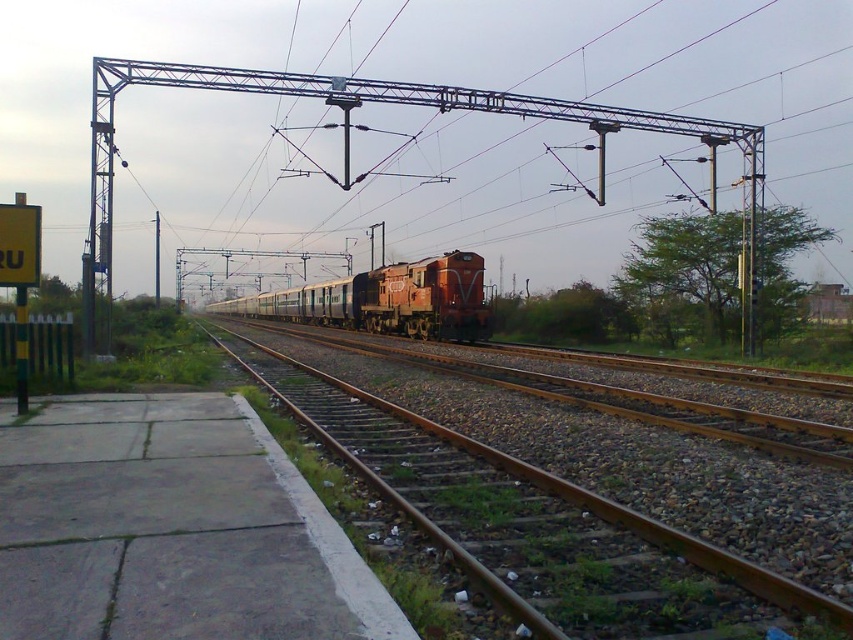
Can you confirm if matte red locomotive at center is taller than metallic pole at left?

No, matte red locomotive at center is not taller than metallic pole at left.

Between point (430, 321) and point (154, 275), which one is positioned in front?

Point (430, 321) is in front.

Who is more distant from viewer, (386, 310) or (158, 268)?

The point (158, 268) is behind.

Image resolution: width=853 pixels, height=640 pixels. Find the location of `matte red locomotive at center`. matte red locomotive at center is located at coordinates (387, 300).

Is brown metal train track at center wider than metallic pole at left?

In fact, brown metal train track at center might be narrower than metallic pole at left.

Can you confirm if brown metal train track at center is bigger than metallic pole at left?

Actually, brown metal train track at center might be smaller than metallic pole at left.

Does point (476, 464) lie behind point (160, 298)?

No, it is not.

I want to click on brown metal train track at center, so click(532, 520).

Between brown metal train track at center and matte red locomotive at center, which one is positioned higher?

matte red locomotive at center is higher up.

Is point (492, 518) positioned behind point (448, 317)?

No.

This screenshot has height=640, width=853. What are the coordinates of `brown metal train track at center` in the screenshot? It's located at (532, 520).